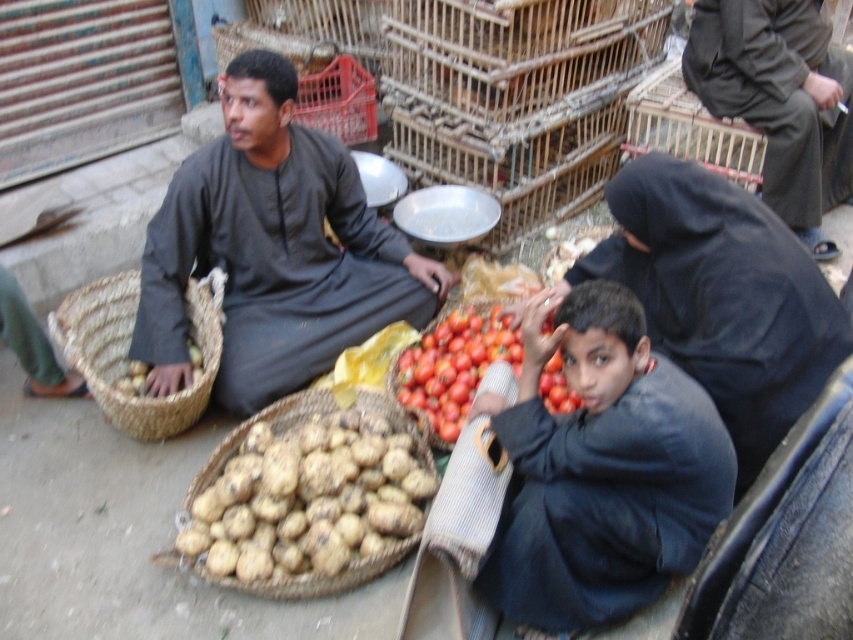
Question: Can you confirm if dark gray fabric at upper right is smaller than brown woven basket at lower left?

Choices:
 (A) yes
 (B) no

Answer: (B)

Question: Which of the following is the farthest from the observer?

Choices:
 (A) dark blue fabric at lower right
 (B) woven brown basket at left
 (C) black matte robe at lower right

Answer: (B)

Question: Among these objects, which one is nearest to the camera?

Choices:
 (A) natural woven basket at center
 (B) black matte robe at lower right

Answer: (B)

Question: Can you confirm if woven brown basket at left is positioned to the right of natural woven basket at center?

Choices:
 (A) yes
 (B) no

Answer: (B)

Question: Observing the image, what is the correct spatial positioning of dark gray fabric man at center in reference to natural woven basket at center?

Choices:
 (A) left
 (B) right

Answer: (B)

Question: Which of these objects is positioned closest to the woven brown basket at left?

Choices:
 (A) natural woven basket at center
 (B) dark gray fabric man at center
 (C) dark blue fabric at lower right
 (D) ripe red tomato at center

Answer: (B)